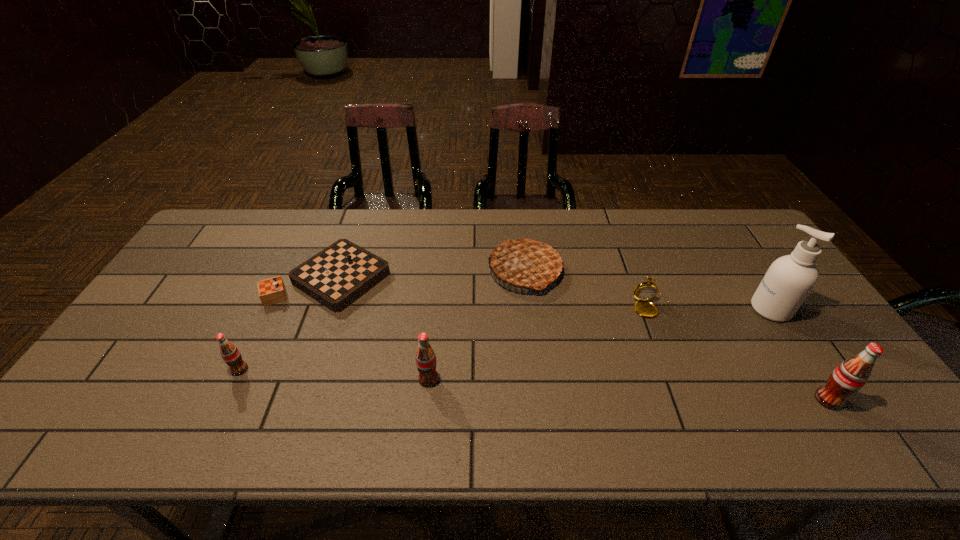
This screenshot has width=960, height=540. Identify the location of free space at the far right corner of the desktop. (737, 225).

Find the location of `vacant region at the near right corner`. vacant region at the near right corner is located at coordinates (850, 402).

Image resolution: width=960 pixels, height=540 pixels. I want to click on free space that is in between the sixth tallest object and the shortest object, so click(x=491, y=293).

The width and height of the screenshot is (960, 540). In order to click on free space between the fifth object from left to right and the leftmost soda in this screenshot , I will do `click(446, 339)`.

Image resolution: width=960 pixels, height=540 pixels. I want to click on empty space between the tallest soda and the pie, so click(677, 335).

Image resolution: width=960 pixels, height=540 pixels. In order to click on vacant point located between the fourth object from right to left and the fifth object from right to left in this screenshot , I will do `click(476, 325)`.

Identify the location of vacant space that's between the shortest object and the third object from left to right. The image size is (960, 540). (379, 328).

Image resolution: width=960 pixels, height=540 pixels. I want to click on unoccupied area between the tallest object and the chessboard, so point(550,293).

Identify the location of free space between the cleansing agent and the second soda from right to left. coord(600,344).

Locate an element on the screen. free space that is in between the chessboard and the pie is located at coordinates (427, 274).